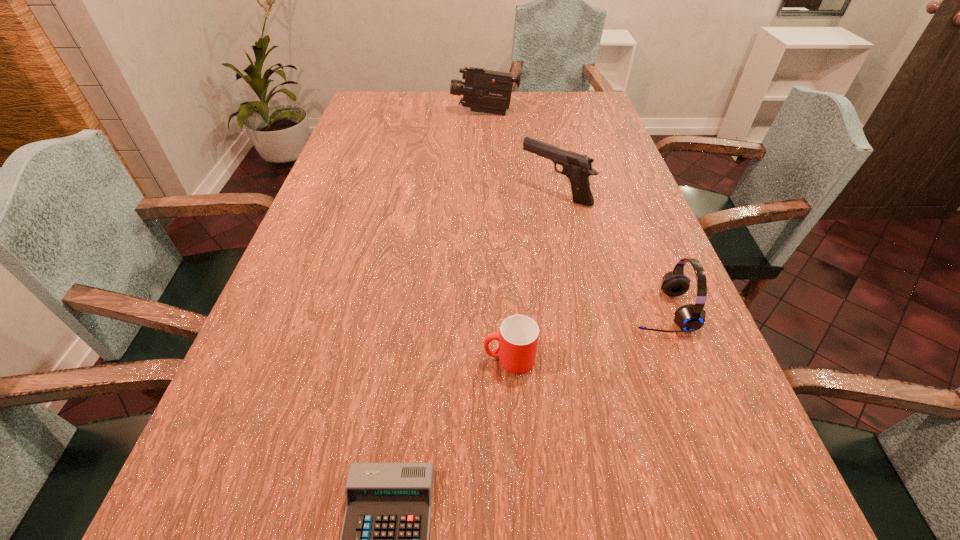
The image size is (960, 540). Identify the location of headset positioned at the right edge. (691, 317).

In the image, there is a desktop. What are the coordinates of `vacant area at the far edge` in the screenshot? It's located at (448, 112).

This screenshot has width=960, height=540. In the image, there is a desktop. In order to click on free space at the left edge in this screenshot , I will do `click(348, 155)`.

In the image, there is a desktop. Find the location of `vacant space at the right edge`. vacant space at the right edge is located at coordinates (651, 347).

At what (x,y) coordinates should I click in order to perform the action: click on free space at the far right corner of the desktop. Please return your answer as a coordinate pair (x, y). Image resolution: width=960 pixels, height=540 pixels. Looking at the image, I should click on (555, 92).

At what (x,y) coordinates should I click in order to perform the action: click on free space between the farthest object and the gun. Please return your answer as a coordinate pair (x, y). Looking at the image, I should click on click(x=520, y=153).

Locate an element on the screen. Image resolution: width=960 pixels, height=540 pixels. unoccupied position between the fourth nearest object and the farthest object is located at coordinates (520, 153).

Find the location of `vacant area that lies between the camcorder and the fourth farthest object`. vacant area that lies between the camcorder and the fourth farthest object is located at coordinates (497, 236).

Find the location of `free spot between the farthest object and the gun`. free spot between the farthest object and the gun is located at coordinates point(520,153).

Locate an element on the screen. empty space between the headset and the second shortest object is located at coordinates (585, 335).